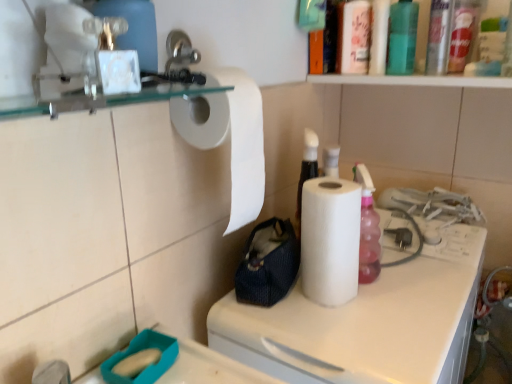
Question: Considering the positions of white matte paper towel at center and translucent plastic bottle at upper right, positioned as the first bottle in front-to-back order, in the image, is white matte paper towel at center wider or thinner than translucent plastic bottle at upper right, positioned as the first bottle in front-to-back order,?

Choices:
 (A) wide
 (B) thin

Answer: (A)

Question: Considering the positions of white matte paper towel at center and translucent plastic bottle at upper right, positioned as the first bottle in front-to-back order, in the image, is white matte paper towel at center taller or shorter than translucent plastic bottle at upper right, positioned as the first bottle in front-to-back order,?

Choices:
 (A) short
 (B) tall

Answer: (B)

Question: Which object is the farthest from the white paper at center, acting as the first paper towel starting from the right?

Choices:
 (A) white matte paper towel at upper left, the second paper towel in the right-to-left sequence
 (B) green matte bottle at upper right, which ranks as the second bottle in front-to-back order
 (C) translucent plastic bottle at upper right, positioned as the first bottle in front-to-back order
 (D) white matte paper towel at center
 (E) navy blue fabric pouch at center

Answer: (C)

Question: Estimate the real-world distances between objects in this image. Which object is farther from the white matte paper towel at upper left, the second paper towel in the right-to-left sequence?

Choices:
 (A) white paper at center, acting as the first paper towel starting from the right
 (B) navy blue fabric pouch at center
 (C) white matte paper towel at center
 (D) translucent plastic bottle at upper right, the second bottle in the back-to-front sequence
 (E) green matte bottle at upper right, arranged as the first bottle when viewed from the back

Answer: (D)